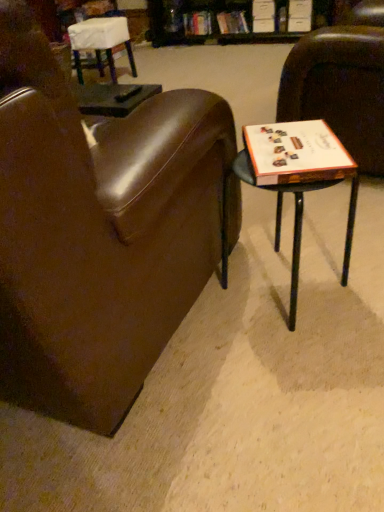
Question: Is brown leather chair at center, which ranks as the first chair in front-to-back order, facing towards white fabric-covered chair at upper left, acting as the 1th chair starting from the left?

Choices:
 (A) no
 (B) yes

Answer: (B)

Question: Can you confirm if brown leather chair at center, which appears as the second chair when viewed from the left, is wider than white fabric-covered chair at upper left, positioned as the third chair in front-to-back order?

Choices:
 (A) yes
 (B) no

Answer: (A)

Question: Is brown leather chair at center, which ranks as the third chair in back-to-front order, outside of white fabric-covered chair at upper left, the first chair positioned from the back?

Choices:
 (A) yes
 (B) no

Answer: (A)

Question: Considering the relative sizes of brown leather chair at center, which ranks as the third chair in back-to-front order, and white fabric-covered chair at upper left, acting as the 1th chair starting from the left, in the image provided, is brown leather chair at center, which ranks as the third chair in back-to-front order, thinner than white fabric-covered chair at upper left, acting as the 1th chair starting from the left,?

Choices:
 (A) no
 (B) yes

Answer: (A)

Question: Is brown leather chair at center, which is the 2th chair in right-to-left order, positioned with its back to white fabric-covered chair at upper left, marked as the third chair in a right-to-left arrangement?

Choices:
 (A) yes
 (B) no

Answer: (B)

Question: Is white paper at right situated inside brown leather chair at right, which is the second chair from back to front, or outside?

Choices:
 (A) inside
 (B) outside

Answer: (B)

Question: Based on their positions, is white paper at right located to the left or right of brown leather chair at right, the 3th chair positioned from the left?

Choices:
 (A) right
 (B) left

Answer: (B)

Question: From their relative heights in the image, would you say white paper at right is taller or shorter than brown leather chair at right, the 3th chair positioned from the left?

Choices:
 (A) tall
 (B) short

Answer: (B)

Question: Considering their positions, is white paper at right located in front of or behind brown leather chair at right, which ranks as the second chair in front-to-back order?

Choices:
 (A) behind
 (B) front

Answer: (B)

Question: Considering the positions of brown leather chair at right, which ranks as the second chair in front-to-back order, and wooden table at right in the image, is brown leather chair at right, which ranks as the second chair in front-to-back order, wider or thinner than wooden table at right?

Choices:
 (A) wide
 (B) thin

Answer: (A)

Question: Considering the positions of point (304, 45) and point (226, 240), is point (304, 45) closer or farther from the camera than point (226, 240)?

Choices:
 (A) closer
 (B) farther

Answer: (B)

Question: Is brown leather chair at right, the first chair in the right-to-left sequence, in front of or behind wooden table at right in the image?

Choices:
 (A) behind
 (B) front

Answer: (A)

Question: From a real-world perspective, is brown leather chair at right, the first chair in the right-to-left sequence, positioned above or below wooden table at right?

Choices:
 (A) below
 (B) above

Answer: (B)

Question: In terms of width, does hardcover book at upper center, acting as the 2th book starting from the right, look wider or thinner when compared to brown leather chair at center, which ranks as the third chair in back-to-front order?

Choices:
 (A) wide
 (B) thin

Answer: (B)

Question: From their relative heights in the image, would you say hardcover book at upper center, the 1th book in the left-to-right sequence, is taller or shorter than brown leather chair at center, which is the 2th chair in right-to-left order?

Choices:
 (A) short
 (B) tall

Answer: (A)